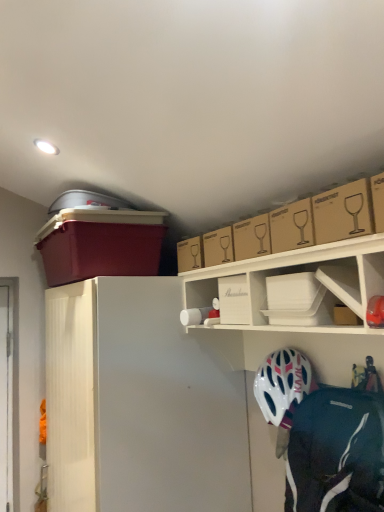
Question: Is brown cardboard box at upper right, which is counted as the 1th box, starting from the right, wider than transparent plastic screen door at left?

Choices:
 (A) yes
 (B) no

Answer: (A)

Question: Does brown cardboard box at upper right, marked as the 4th box in a back-to-front arrangement, have a lesser width compared to transparent plastic screen door at left?

Choices:
 (A) no
 (B) yes

Answer: (A)

Question: Is brown cardboard box at upper right, the 4th box from the left, in contact with transparent plastic screen door at left?

Choices:
 (A) yes
 (B) no

Answer: (B)

Question: Is brown cardboard box at upper right, the 4th box from the left, smaller than transparent plastic screen door at left?

Choices:
 (A) no
 (B) yes

Answer: (B)

Question: From the image's perspective, would you say brown cardboard box at upper right, which is counted as the 1th box, starting from the right, is shown under transparent plastic screen door at left?

Choices:
 (A) no
 (B) yes

Answer: (A)

Question: Is brown cardboard box at upper right, the 4th box from the left, shorter than transparent plastic screen door at left?

Choices:
 (A) yes
 (B) no

Answer: (A)

Question: From the image's perspective, is brown cardboard box at upper right beneath white matte refrigerator at left?

Choices:
 (A) no
 (B) yes

Answer: (A)

Question: Can you confirm if brown cardboard box at upper right is wider than white matte refrigerator at left?

Choices:
 (A) no
 (B) yes

Answer: (A)

Question: Considering the relative sizes of brown cardboard box at upper right and white matte refrigerator at left in the image provided, is brown cardboard box at upper right taller than white matte refrigerator at left?

Choices:
 (A) no
 (B) yes

Answer: (A)

Question: Is brown cardboard box at upper right touching white matte refrigerator at left?

Choices:
 (A) yes
 (B) no

Answer: (B)

Question: From the image's perspective, is brown cardboard box at upper right located above white matte refrigerator at left?

Choices:
 (A) yes
 (B) no

Answer: (A)

Question: Is brown cardboard box at upper right smaller than white matte refrigerator at left?

Choices:
 (A) yes
 (B) no

Answer: (A)

Question: Can you confirm if white matte shelf at upper center is wider than white plastic container at upper center, placed as the second box when sorted from right to left?

Choices:
 (A) no
 (B) yes

Answer: (B)